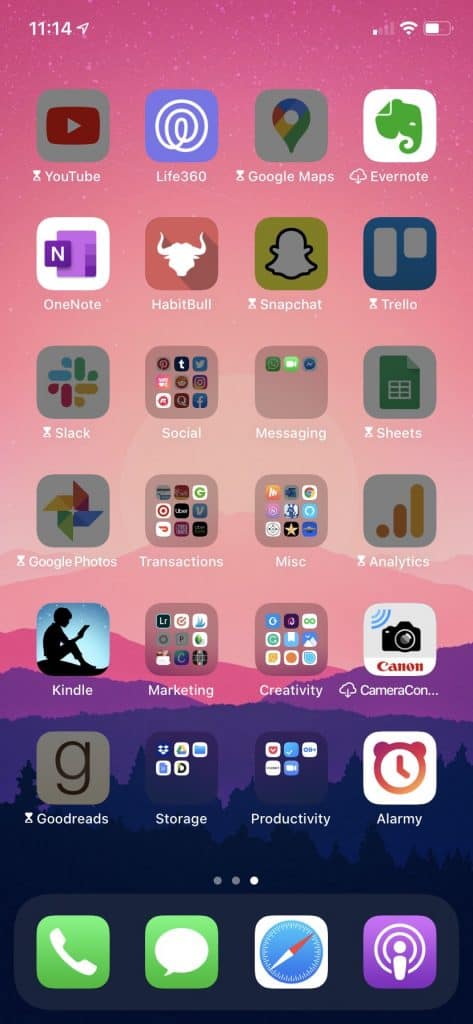
The width and height of the screenshot is (473, 1024). I want to click on wifi, so click(408, 31).